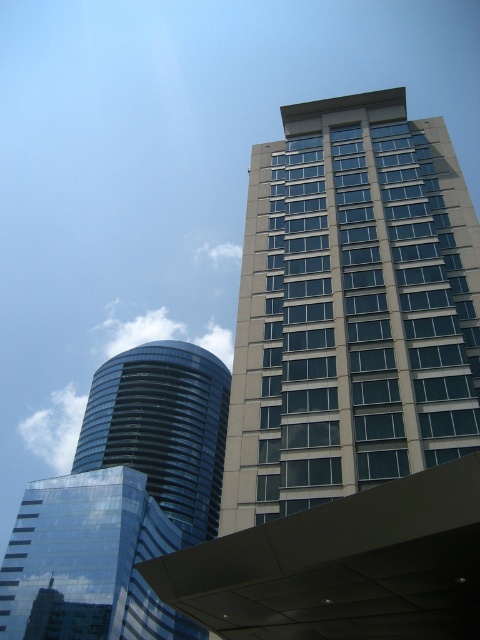
Image resolution: width=480 pixels, height=640 pixels. I want to click on beige glass building at upper right, so click(x=350, y=308).

Is beige glass building at upper right taller than glossy glass building at lower left?

No, beige glass building at upper right is not taller than glossy glass building at lower left.

You are a GUI agent. You are given a task and a screenshot of the screen. Output one action in this format:
    pyautogui.click(x=<x>, y=<y>)
    Task: Click on the beige glass building at upper right
    
    Given the screenshot: What is the action you would take?
    pyautogui.click(x=350, y=308)

Locate an element on the screen. Image resolution: width=480 pixels, height=640 pixels. beige glass building at upper right is located at coordinates (350, 308).

Where is `glossy glass building at lower left`? This screenshot has width=480, height=640. glossy glass building at lower left is located at coordinates (87, 561).

Who is lower down, glossy glass building at lower left or shiny glass tower at center left?

glossy glass building at lower left is below.

I want to click on glossy glass building at lower left, so click(87, 561).

Identify the location of glossy glass building at lower left. The width and height of the screenshot is (480, 640). (87, 561).

Between beige glass building at upper right and shiny glass tower at center left, which one is positioned higher?

beige glass building at upper right

Between beige glass building at upper right and shiny glass tower at center left, which one has less height?

With less height is beige glass building at upper right.

Identify the location of beige glass building at upper right. (350, 308).